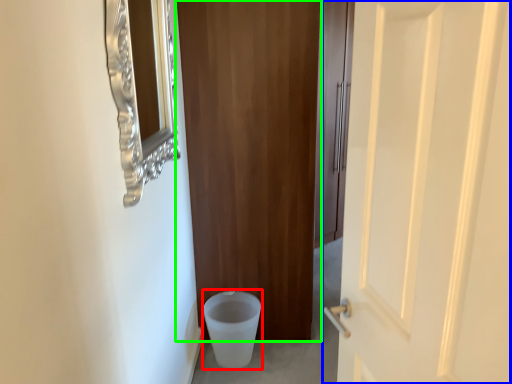
Question: Considering the real-world distances, which object is farthest from potty (highlighted by a red box)? door (highlighted by a blue box) or door (highlighted by a green box)?

Choices:
 (A) door
 (B) door

Answer: (A)